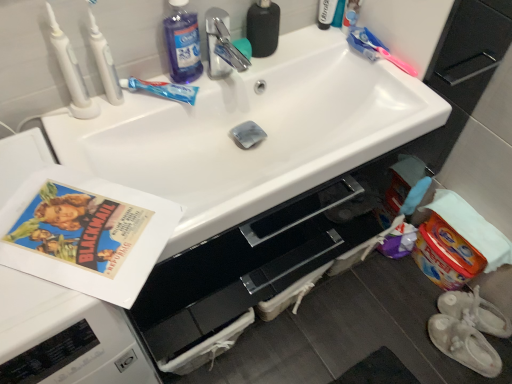
Question: Would you say blue liquid at upper left is to the left or to the right of pink plastic toothbrush at upper right, which is the fourth toothbrush from left to right, in the picture?

Choices:
 (A) left
 (B) right

Answer: (A)

Question: In terms of width, does blue liquid at upper left look wider or thinner when compared to pink plastic toothbrush at upper right, the 1th toothbrush viewed from the right?

Choices:
 (A) wide
 (B) thin

Answer: (A)

Question: Estimate the real-world distances between objects in this image. Which object is closer to the white plastic toothbrush at upper left, arranged as the fourth toothbrush when viewed from the right?

Choices:
 (A) black matte bottle at upper center
 (B) vintage paper at left
 (C) translucent blue toothpaste at upper center, placed as the second toothbrush when sorted from right to left
 (D) pink plastic toothbrush at upper right, the 1th toothbrush viewed from the right
 (E) white plastic toothbrush at upper left, the second toothbrush viewed from the left

Answer: (E)

Question: Which is farther from the pink plastic toothbrush at upper right, which is the fourth toothbrush from left to right?

Choices:
 (A) white fabric baby shoes at lower right, which is the 2th footwear in front-to-back order
 (B) white plastic tube at upper right
 (C) black matte bottle at upper center
 (D) translucent blue toothpaste at upper center, placed as the second toothbrush when sorted from right to left
 (E) vintage paper at left

Answer: (A)